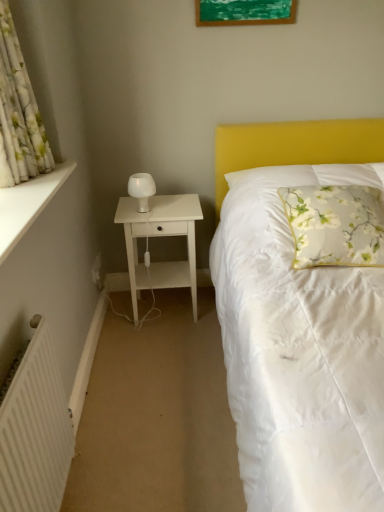
In order to click on vacant space underneath white floral fabric curtain at left (from a real-world perspective) in this screenshot , I will do `click(29, 182)`.